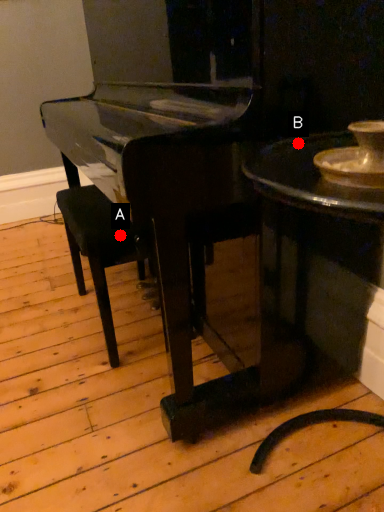
Question: Two points are circled on the image, labeled by A and B beside each circle. Which point is closer to the camera taking this photo?

Choices:
 (A) A is closer
 (B) B is closer

Answer: (B)